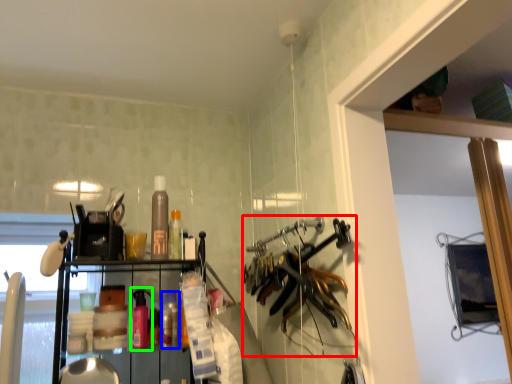
Question: Which object is the farthest from hanger (highlighted by a red box)? Choose among these: bottle (highlighted by a blue box) or bottle (highlighted by a green box).

Choices:
 (A) bottle
 (B) bottle

Answer: (B)